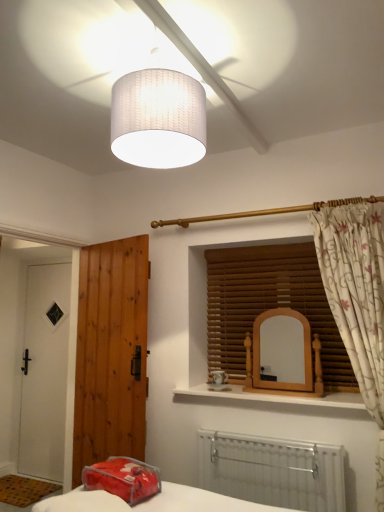
Question: Is white matte door at left, which ranks as the second door in right-to-left order, positioned with its back to white textured lampshade at upper center?

Choices:
 (A) no
 (B) yes

Answer: (A)

Question: Is white matte door at left, which ranks as the second door in right-to-left order, at the right side of white textured lampshade at upper center?

Choices:
 (A) no
 (B) yes

Answer: (A)

Question: Considering the relative sizes of white matte door at left, which ranks as the second door in right-to-left order, and white textured lampshade at upper center in the image provided, is white matte door at left, which ranks as the second door in right-to-left order, taller than white textured lampshade at upper center?

Choices:
 (A) yes
 (B) no

Answer: (A)

Question: Can you confirm if white matte door at left, marked as the 2th door in a front-to-back arrangement, is shorter than white textured lampshade at upper center?

Choices:
 (A) no
 (B) yes

Answer: (A)

Question: Is white matte door at left, marked as the 2th door in a front-to-back arrangement, located outside white textured lampshade at upper center?

Choices:
 (A) yes
 (B) no

Answer: (A)

Question: Considering the relative positions of white matte door at left, which appears as the first door when viewed from the back, and white textured lampshade at upper center in the image provided, is white matte door at left, which appears as the first door when viewed from the back, in front of white textured lampshade at upper center?

Choices:
 (A) yes
 (B) no

Answer: (B)

Question: Is brown wooden door at left, acting as the 1th door starting from the front, positioned far away from white matte door at left, which ranks as the second door in right-to-left order?

Choices:
 (A) yes
 (B) no

Answer: (B)

Question: Is brown wooden door at left, the 2th door positioned from the back, to the right of white matte door at left, which is the first door from left to right, from the viewer's perspective?

Choices:
 (A) yes
 (B) no

Answer: (A)

Question: Considering the relative sizes of brown wooden door at left, acting as the 1th door starting from the front, and white matte door at left, marked as the 2th door in a front-to-back arrangement, in the image provided, is brown wooden door at left, acting as the 1th door starting from the front, thinner than white matte door at left, marked as the 2th door in a front-to-back arrangement,?

Choices:
 (A) no
 (B) yes

Answer: (A)

Question: Considering the relative sizes of brown wooden door at left, the 2th door positioned from the back, and white matte door at left, which ranks as the second door in right-to-left order, in the image provided, is brown wooden door at left, the 2th door positioned from the back, shorter than white matte door at left, which ranks as the second door in right-to-left order,?

Choices:
 (A) no
 (B) yes

Answer: (B)

Question: From the image's perspective, is brown wooden door at left, the 2th door positioned from the back, below white matte door at left, which appears as the first door when viewed from the back?

Choices:
 (A) yes
 (B) no

Answer: (B)

Question: Considering the relative sizes of brown wooden door at left, acting as the first door starting from the right, and white matte door at left, which ranks as the second door in right-to-left order, in the image provided, is brown wooden door at left, acting as the first door starting from the right, bigger than white matte door at left, which ranks as the second door in right-to-left order,?

Choices:
 (A) yes
 (B) no

Answer: (A)

Question: Considering the relative sizes of translucent plastic pillow at lower center and floral fabric curtain at right in the image provided, is translucent plastic pillow at lower center bigger than floral fabric curtain at right?

Choices:
 (A) yes
 (B) no

Answer: (B)